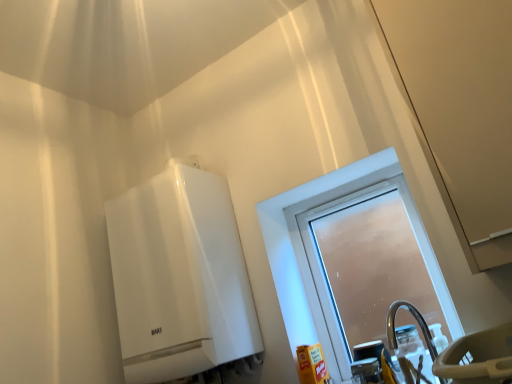
Question: Looking at their shapes, would you say white glossy water heater at upper left is wider or thinner than frosted glass window at center?

Choices:
 (A) thin
 (B) wide

Answer: (B)

Question: In the image, is white glossy water heater at upper left on the left side or the right side of frosted glass window at center?

Choices:
 (A) left
 (B) right

Answer: (A)

Question: Which is farther from the white glossy water heater at upper left?

Choices:
 (A) translucent plastic bottle at lower right
 (B) transparent plastic screen door at upper right
 (C) frosted glass window at center

Answer: (B)

Question: Estimate the real-world distances between objects in this image. Which object is closer to the white glossy water heater at upper left?

Choices:
 (A) transparent plastic screen door at upper right
 (B) frosted glass window at center
 (C) translucent plastic bottle at lower right

Answer: (B)